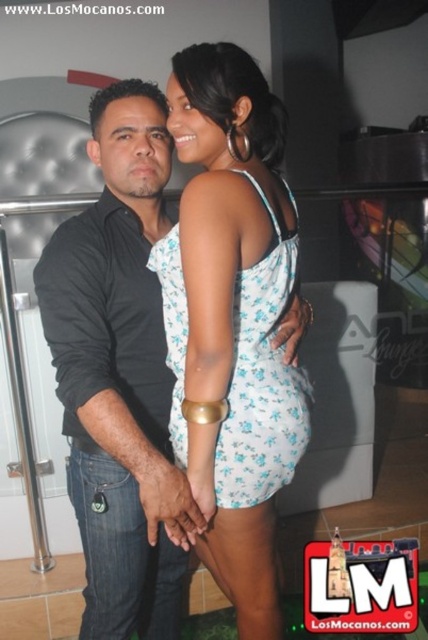
You are a photographer setting up for a photoshoot. You need to adjust the lighting so that the matte black shirt at left and the white floral fabric dress at center are both well illuminated. Considering their heights, which object should you place the light closer to?

The matte black shirt at left is much taller than the white floral fabric dress at center, so you should place the light closer to the white floral fabric dress at center to ensure proper illumination for both subjects.